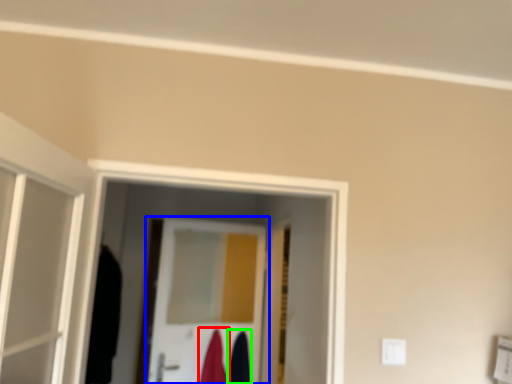
Question: Which object is the closest to the robe (highlighted by a red box)? Choose among these: door (highlighted by a blue box) or robe (highlighted by a green box).

Choices:
 (A) door
 (B) robe

Answer: (B)